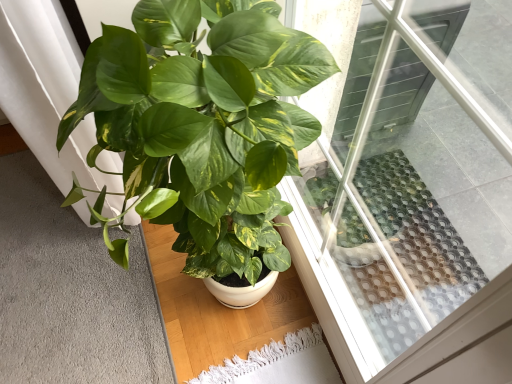
Question: Is transparent glass window at upper center positioned with its back to green glossy leafy plant at center?

Choices:
 (A) no
 (B) yes

Answer: (B)

Question: Does transparent glass window at upper center appear on the right side of green glossy leafy plant at center?

Choices:
 (A) yes
 (B) no

Answer: (A)

Question: Is transparent glass window at upper center outside of green glossy leafy plant at center?

Choices:
 (A) no
 (B) yes

Answer: (B)

Question: Is transparent glass window at upper center oriented towards green glossy leafy plant at center?

Choices:
 (A) yes
 (B) no

Answer: (A)

Question: Does transparent glass window at upper center have a lesser height compared to green glossy leafy plant at center?

Choices:
 (A) yes
 (B) no

Answer: (B)

Question: Is transparent glass window at upper center in front of or behind green glossy leafy plant at center in the image?

Choices:
 (A) front
 (B) behind

Answer: (A)

Question: Considering the positions of transparent glass window at upper center and green glossy leafy plant at center in the image, is transparent glass window at upper center taller or shorter than green glossy leafy plant at center?

Choices:
 (A) short
 (B) tall

Answer: (B)

Question: In terms of size, does transparent glass window at upper center appear bigger or smaller than green glossy leafy plant at center?

Choices:
 (A) small
 (B) big

Answer: (A)

Question: Do you think transparent glass window at upper center is within green glossy leafy plant at center, or outside of it?

Choices:
 (A) inside
 (B) outside

Answer: (B)

Question: Looking at the image, does soft gray carpet at lower left seem bigger or smaller compared to transparent glass window at upper center?

Choices:
 (A) small
 (B) big

Answer: (A)

Question: From a real-world perspective, relative to transparent glass window at upper center, is soft gray carpet at lower left vertically above or below?

Choices:
 (A) above
 (B) below

Answer: (B)

Question: From the image's perspective, is soft gray carpet at lower left above or below transparent glass window at upper center?

Choices:
 (A) above
 (B) below

Answer: (B)

Question: Relative to transparent glass window at upper center, is soft gray carpet at lower left in front or behind?

Choices:
 (A) behind
 (B) front

Answer: (A)

Question: Would you say green glossy leafy plant at center is inside or outside transparent glass window at upper center?

Choices:
 (A) inside
 (B) outside

Answer: (B)

Question: From the image's perspective, is green glossy leafy plant at center positioned above or below transparent glass window at upper center?

Choices:
 (A) below
 (B) above

Answer: (A)